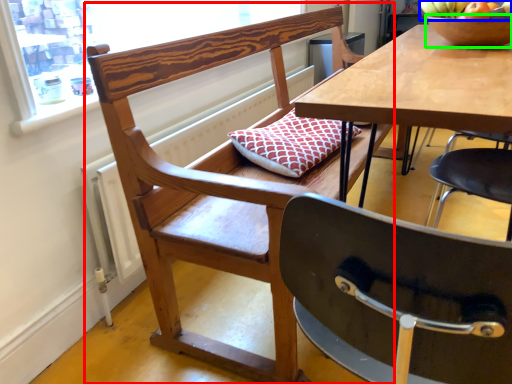
Question: Considering the real-world distances, which object is closest to chair (highlighted by a red box)? fruit (highlighted by a blue box) or bowl (highlighted by a green box).

Choices:
 (A) fruit
 (B) bowl

Answer: (B)